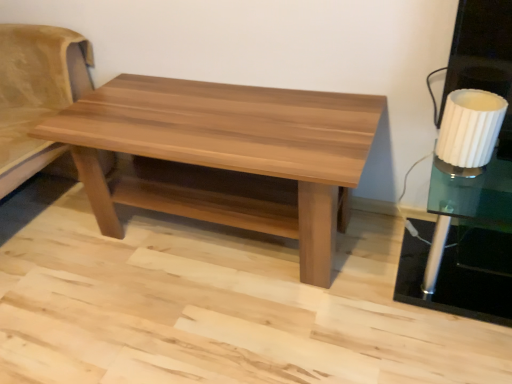
Measure the distance between point [28,116] and camera.

Point [28,116] and camera are 5.72 feet apart.

What do you see at coordinates (36, 93) in the screenshot?
I see `suede beige futon at left` at bounding box center [36, 93].

Find the location of a particular element. This screenshot has height=384, width=512. white ribbed glass at right is located at coordinates (470, 128).

Find the location of a particular element. suede beige futon at left is located at coordinates (36, 93).

From the picture: Can you tell me how much suede beige futon at left and light brown wood coffee table at center differ in facing direction?

The angle between the facing direction of suede beige futon at left and the facing direction of light brown wood coffee table at center is 1.01 degrees.

Is suede beige futon at left directly adjacent to light brown wood coffee table at center?

No, suede beige futon at left is not next to light brown wood coffee table at center.

Looking at their sizes, would you say suede beige futon at left is wider or thinner than light brown wood coffee table at center?

Clearly, suede beige futon at left has more width compared to light brown wood coffee table at center.

From a real-world perspective, does suede beige futon at left sit lower than light brown wood coffee table at center?

No, from a real-world perspective, suede beige futon at left is not below light brown wood coffee table at center.

Is suede beige futon at left at the back of white ribbed glass side table at right?

No.

Which is farther, (466,216) or (7,27)?

The point (7,27) is more distant.

How distant is white ribbed glass side table at right from suede beige futon at left?

white ribbed glass side table at right is 5.01 feet from suede beige futon at left.

Based on the photo, is white ribbed glass side table at right wider or thinner than suede beige futon at left?

In the image, white ribbed glass side table at right appears to be more narrow than suede beige futon at left.

Is white ribbed glass side table at right thinner than light brown wood coffee table at center?

Yes, white ribbed glass side table at right is thinner than light brown wood coffee table at center.

Are white ribbed glass side table at right and light brown wood coffee table at center beside each other?

white ribbed glass side table at right is not next to light brown wood coffee table at center, and they're not touching.

Which of these two, white ribbed glass side table at right or light brown wood coffee table at center, stands taller?

light brown wood coffee table at center.

Does point (70, 49) appear closer or farther from the camera than point (438, 197)?

Point (70, 49) is positioned farther from the camera compared to point (438, 197).

Is white ribbed glass side table at right at the back of suede beige futon at left?

No.

Is the position of suede beige futon at left more distant than that of white ribbed glass side table at right?

Yes.

Choose the correct answer: Is white ribbed glass at right inside suede beige futon at left or outside it?

white ribbed glass at right cannot be found inside suede beige futon at left.

Considering the sizes of objects white ribbed glass at right and suede beige futon at left in the image provided, who is wider, white ribbed glass at right or suede beige futon at left?

Wider between the two is suede beige futon at left.

Does white ribbed glass at right have a larger size compared to suede beige futon at left?

Incorrect, white ribbed glass at right is not larger than suede beige futon at left.

From the image's perspective, which one is positioned higher, white ribbed glass at right or suede beige futon at left?

suede beige futon at left is shown above in the image.

Which of these two, light brown wood coffee table at center or white ribbed glass side table at right, is smaller?

Smaller between the two is white ribbed glass side table at right.

Is light brown wood coffee table at center taller than white ribbed glass side table at right?

Yes, light brown wood coffee table at center is taller than white ribbed glass side table at right.

Considering the sizes of objects suede beige futon at left and white ribbed glass at right in the image provided, who is smaller, suede beige futon at left or white ribbed glass at right?

Smaller between the two is white ribbed glass at right.

Can you tell me how much suede beige futon at left and white ribbed glass at right differ in facing direction?

suede beige futon at left and white ribbed glass at right are facing 4.49 degrees away from each other.

Is suede beige futon at left placed right next to white ribbed glass at right?

There is a gap between suede beige futon at left and white ribbed glass at right.

From a real-world perspective, which object rests below the other?

suede beige futon at left, from a real-world perspective.

Locate an element on the screen. The width and height of the screenshot is (512, 384). coffee table located on the right of suede beige futon at left is located at coordinates (225, 156).

The width and height of the screenshot is (512, 384). Find the location of `side table below the suede beige futon at left (from the image's perspective)`. side table below the suede beige futon at left (from the image's perspective) is located at coordinates (465, 202).

Considering their positions, is white ribbed glass at right positioned further to light brown wood coffee table at center than white ribbed glass side table at right?

Among the two, white ribbed glass side table at right is located further to light brown wood coffee table at center.

When comparing their distances from suede beige futon at left, does white ribbed glass side table at right or light brown wood coffee table at center seem closer?

light brown wood coffee table at center is positioned closer to the anchor suede beige futon at left.

Looking at the image, which one is located closer to white ribbed glass at right, light brown wood coffee table at center or suede beige futon at left?

light brown wood coffee table at center is positioned closer to the anchor white ribbed glass at right.

From the image, which object appears to be nearer to white ribbed glass side table at right, light brown wood coffee table at center or white ribbed glass at right?

The object closer to white ribbed glass side table at right is white ribbed glass at right.

Estimate the real-world distances between objects in this image. Which object is further from white ribbed glass at right, light brown wood coffee table at center or white ribbed glass side table at right?

light brown wood coffee table at center lies further to white ribbed glass at right than the other object.

When comparing their distances from white ribbed glass side table at right, does white ribbed glass at right or light brown wood coffee table at center seem further?

The object further to white ribbed glass side table at right is light brown wood coffee table at center.

When comparing their distances from suede beige futon at left, does white ribbed glass side table at right or white ribbed glass at right seem closer?

Based on the image, white ribbed glass at right appears to be nearer to suede beige futon at left.

From the image, which object appears to be nearer to light brown wood coffee table at center, suede beige futon at left or white ribbed glass at right?

Among the two, suede beige futon at left is located nearer to light brown wood coffee table at center.

Image resolution: width=512 pixels, height=384 pixels. Identify the location of table lamp between suede beige futon at left and white ribbed glass side table at right. (470, 128).

Where is `coffee table between suede beige futon at left and white ribbed glass at right from left to right`? coffee table between suede beige futon at left and white ribbed glass at right from left to right is located at coordinates (225, 156).

The height and width of the screenshot is (384, 512). I want to click on coffee table situated between suede beige futon at left and white ribbed glass side table at right from left to right, so click(225, 156).

You are a GUI agent. You are given a task and a screenshot of the screen. Output one action in this format:
    pyautogui.click(x=<x>, y=<y>)
    Task: Click on the table lamp between light brown wood coffee table at center and white ribbed glass side table at right in the horizontal direction
    The image size is (512, 384).
    Given the screenshot: What is the action you would take?
    pyautogui.click(x=470, y=128)